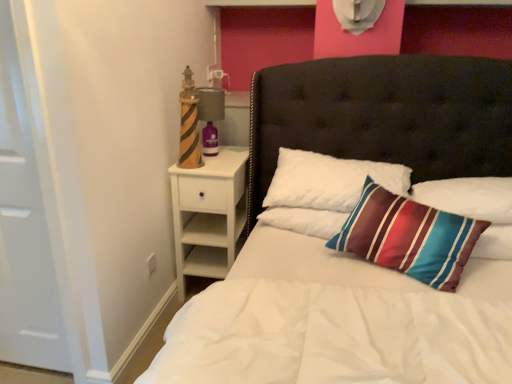
Question: Choose the correct answer: Is white matte door at left inside white wood nightstand at left or outside it?

Choices:
 (A) outside
 (B) inside

Answer: (A)

Question: Is white matte door at left to the left or to the right of white wood nightstand at left in the image?

Choices:
 (A) left
 (B) right

Answer: (A)

Question: Estimate the real-world distances between objects in this image. Which object is farther from the teal striped pillow at upper right, the 1th pillow from the right?

Choices:
 (A) matte gray lamp at upper left
 (B) white quilted pillow at center, the second pillow in the right-to-left sequence
 (C) white matte door at left
 (D) white quilted bed at center
 (E) white wood nightstand at left

Answer: (C)

Question: Which is nearer to the matte gray lamp at upper left?

Choices:
 (A) teal striped pillow at upper right, the second pillow when ordered from left to right
 (B) white matte door at left
 (C) white wood nightstand at left
 (D) white quilted pillow at center, the second pillow in the right-to-left sequence
 (E) white quilted bed at center

Answer: (C)